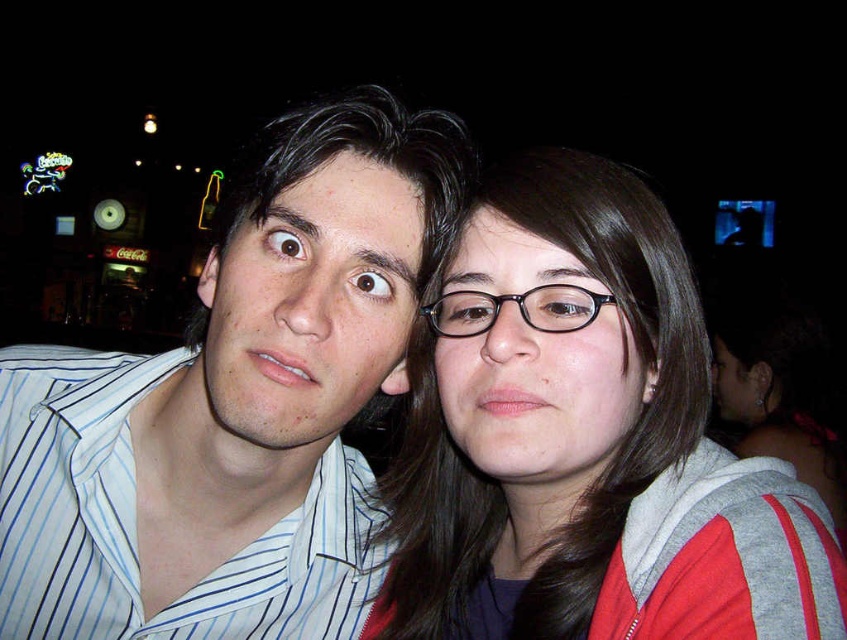
Can you confirm if white striped shirt at left is positioned below black plastic glasses at center?

Yes.

Is white striped shirt at left positioned at the back of black plastic glasses at center?

No, white striped shirt at left is in front of black plastic glasses at center.

Does point (257, 316) come behind point (563, 292)?

Yes, point (257, 316) is behind point (563, 292).

Locate an element on the screen. The height and width of the screenshot is (640, 847). white striped shirt at left is located at coordinates (233, 406).

Who is more distant from viewer, [549,317] or [454,308]?

The point [454,308] is more distant.

Can you confirm if matte gray hoodie at center is bigger than black plastic glasses at center?

Correct, matte gray hoodie at center is larger in size than black plastic glasses at center.

Is point (444, 300) closer to viewer compared to point (484, 292)?

No, it is behind (484, 292).

The height and width of the screenshot is (640, 847). I want to click on matte gray hoodie at center, so click(585, 440).

Does white striped shirt at left have a larger size compared to matte gray hoodie at center?

Correct, white striped shirt at left is larger in size than matte gray hoodie at center.

Between point (392, 113) and point (613, 163), which one is positioned in front?

Point (392, 113)

Locate an element on the screen. This screenshot has height=640, width=847. white striped shirt at left is located at coordinates (233, 406).